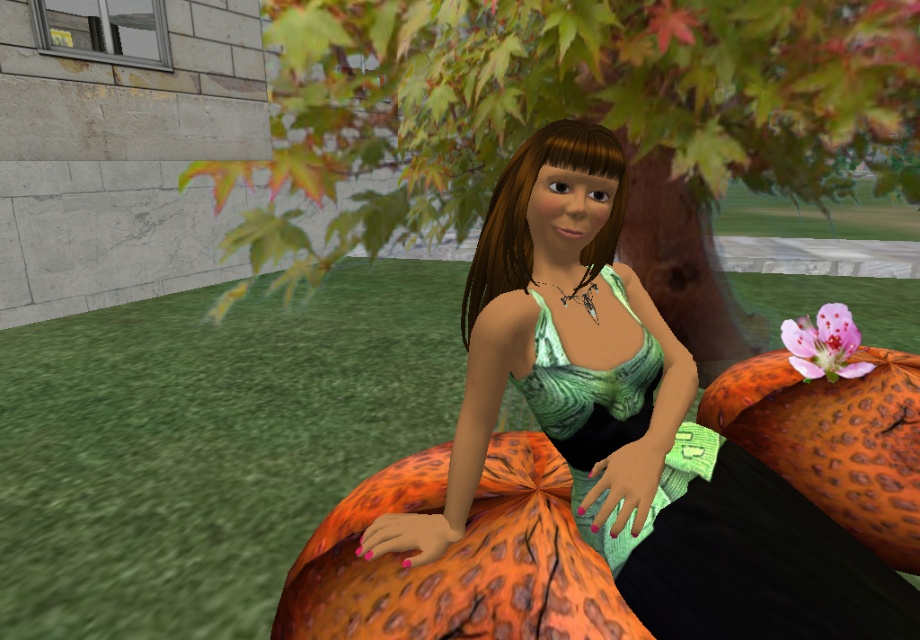
Between point (263, 220) and point (611, 390), which one is positioned behind?

The point (263, 220) is more distant.

This screenshot has height=640, width=920. Identify the location of green leafy tree at center. (587, 118).

The image size is (920, 640). I want to click on green grass at lower left, so click(207, 444).

Describe the element at coordinates (207, 444) in the screenshot. The height and width of the screenshot is (640, 920). I see `green grass at lower left` at that location.

Describe the element at coordinates (207, 444) in the screenshot. I see `green grass at lower left` at that location.

Identify the location of green grass at lower left. (207, 444).

Which is behind, point (138, 618) or point (825, 308)?

Positioned behind is point (825, 308).

Is point (399, 412) positioned in front of point (800, 369)?

No.

Is point (190, 445) behind point (840, 310)?

Yes, it is behind point (840, 310).

Where is `green grass at lower left`? This screenshot has height=640, width=920. green grass at lower left is located at coordinates (207, 444).